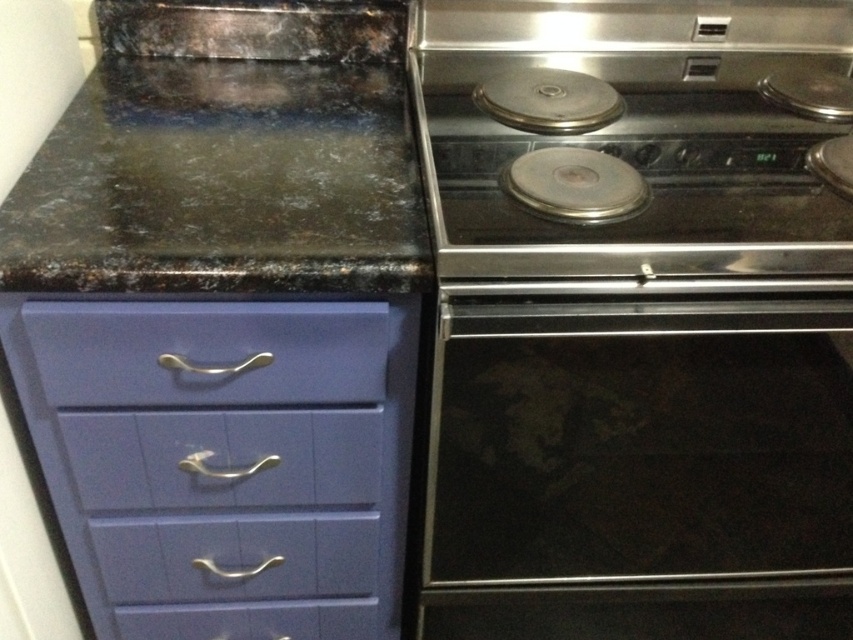
This screenshot has width=853, height=640. What do you see at coordinates (223, 458) in the screenshot?
I see `matte blue drawer at lower left` at bounding box center [223, 458].

Between matte blue drawer at lower left and purple glossy drawer at lower left, which one has less height?

purple glossy drawer at lower left is shorter.

Where is `matte blue drawer at lower left`? matte blue drawer at lower left is located at coordinates (223, 458).

Image resolution: width=853 pixels, height=640 pixels. Identify the location of matte blue drawer at lower left. (223, 458).

Who is positioned more to the left, black granite countertop at upper left or purple glossy drawer at lower left?

Positioned to the left is black granite countertop at upper left.

Does black granite countertop at upper left have a lesser height compared to purple glossy drawer at lower left?

No.

Is point (78, 120) closer to camera compared to point (339, 362)?

No, (78, 120) is further to viewer.

What are the coordinates of `black granite countertop at upper left` in the screenshot? It's located at (222, 182).

Does black glass oven at center have a lesser width compared to matte purple drawer at center?

No.

Image resolution: width=853 pixels, height=640 pixels. What do you see at coordinates (637, 476) in the screenshot?
I see `black glass oven at center` at bounding box center [637, 476].

Identify the location of black glass oven at center. (637, 476).